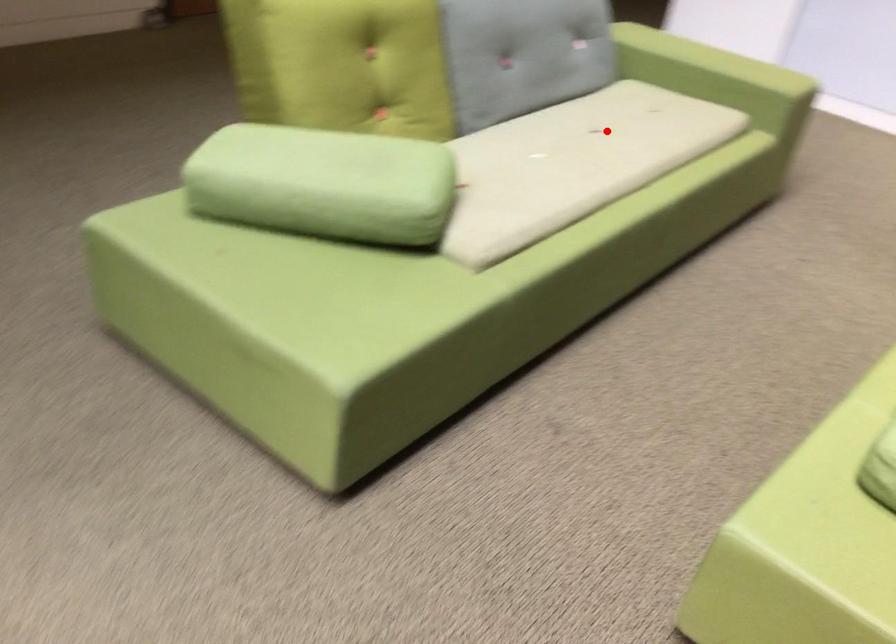
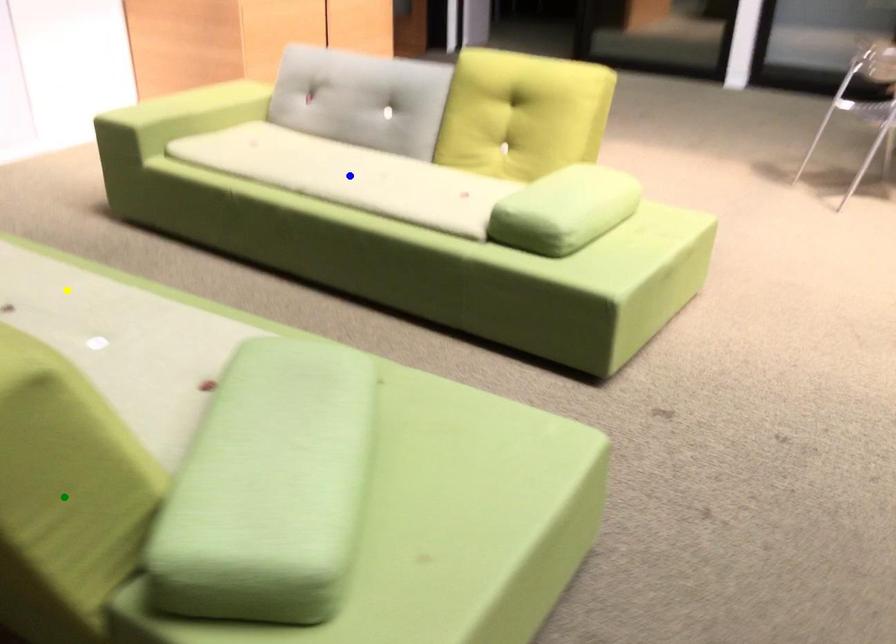
Question: I am providing you with two images of the same scene from different viewpoints. A red point is marked on the first image. You are given multiple points on the second image. Which mark in image 2 goes with the point in image 1?

Choices:
 (A) blue point
 (B) green point
 (C) yellow point

Answer: (C)